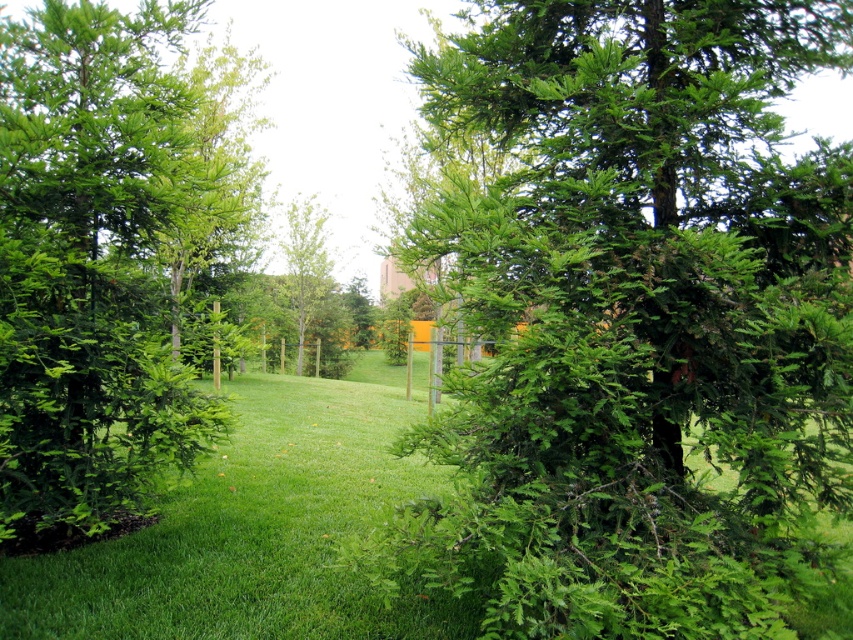
Question: Can you confirm if green needle-like at center is smaller than green leafy tree at center?

Choices:
 (A) yes
 (B) no

Answer: (B)

Question: Which point appears closest to the camera in this image?

Choices:
 (A) tap(534, 388)
 (B) tap(160, 385)

Answer: (A)

Question: Which object appears farthest from the camera in this image?

Choices:
 (A) green needle-like at left
 (B) green needle-like at center

Answer: (A)

Question: Does green needle-like at center have a lesser width compared to green needle-like at left?

Choices:
 (A) yes
 (B) no

Answer: (A)

Question: Does green needle-like at center appear over green needle-like at left?

Choices:
 (A) no
 (B) yes

Answer: (A)

Question: Which object is farther from the camera taking this photo?

Choices:
 (A) green needle-like at left
 (B) green leafy tree at center
 (C) green needle-like at center

Answer: (B)